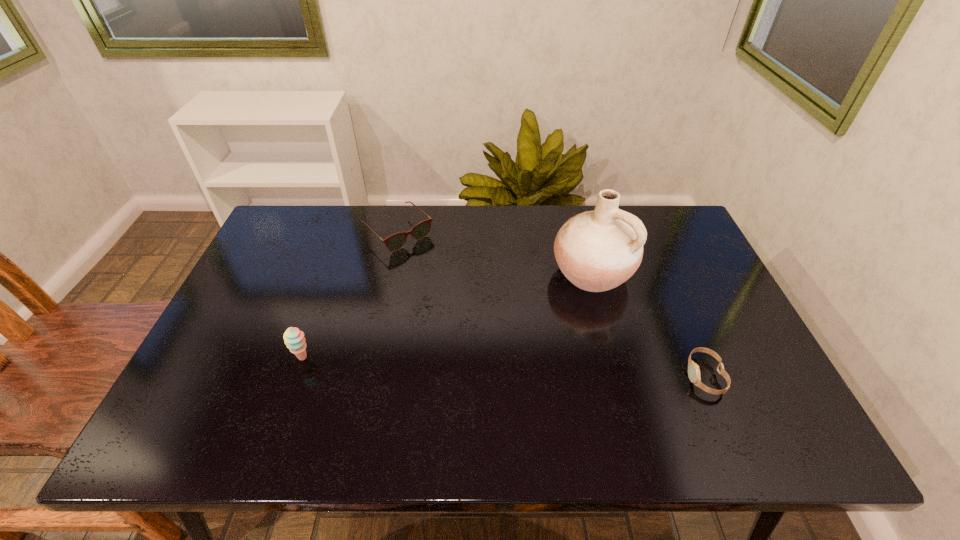
Identify the location of vacant space on the desktop that is between the sherbert and the shortest object and is positioned to pour from the handle of the pottery. pos(472,365).

At what (x,y) coordinates should I click in order to perform the action: click on free spot on the desktop that is between the leftmost object and the rightmost object and is positioned at the front view of the third object from right to left. Please return your answer as a coordinate pair (x, y). The height and width of the screenshot is (540, 960). Looking at the image, I should click on (545, 368).